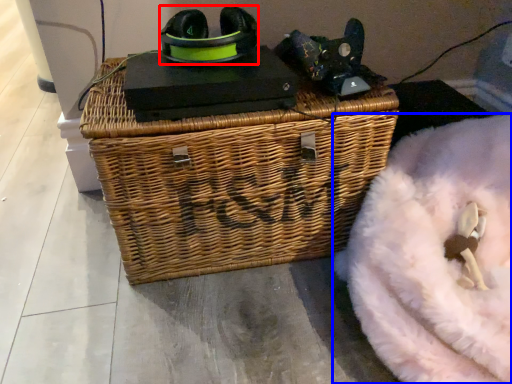
Question: Which object is further to the camera taking this photo, shoe (highlighted by a red box) or bean bag chair (highlighted by a blue box)?

Choices:
 (A) shoe
 (B) bean bag chair

Answer: (A)